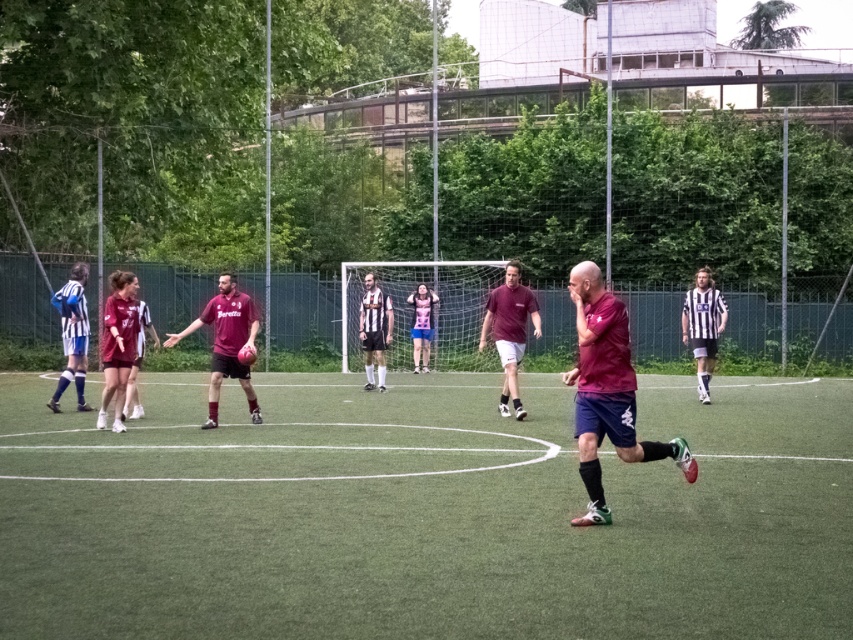
Question: Is striped jersey at center thinner than pink fabric shirt at center?

Choices:
 (A) yes
 (B) no

Answer: (A)

Question: Which point is closer to the camera taking this photo?

Choices:
 (A) [703, 346]
 (B) [796, 442]

Answer: (B)

Question: Is matte maroon jersey at center positioned behind matte maroon shirt at center?

Choices:
 (A) no
 (B) yes

Answer: (A)

Question: Does striped jersey referee at left appear on the left side of pink fabric shirt at center?

Choices:
 (A) yes
 (B) no

Answer: (A)

Question: Which point appears farthest from the camera in this image?

Choices:
 (A) (73, 353)
 (B) (358, 307)
 (C) (515, 333)

Answer: (B)

Question: Which of the following is the farthest from the observer?

Choices:
 (A) pink fabric shirt at center
 (B) striped jersey referee at left
 (C) maroon jersey at center

Answer: (A)